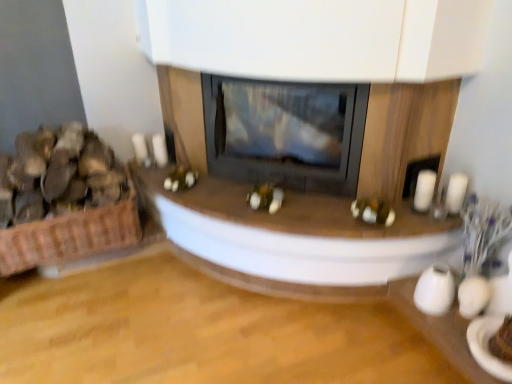
Question: Could you tell me if white glossy candle at right, which ranks as the 1th candle in right-to-left order, is turned towards brown woven basket at left?

Choices:
 (A) no
 (B) yes

Answer: (A)

Question: Is white glossy candle at right, placed as the second candle when sorted from left to right, completely or partially outside of brown woven basket at left?

Choices:
 (A) no
 (B) yes

Answer: (B)

Question: From a real-world perspective, is white glossy candle at right, which ranks as the 1th candle in right-to-left order, on brown woven basket at left?

Choices:
 (A) no
 (B) yes

Answer: (A)

Question: Would you consider white glossy candle at right, which ranks as the 1th candle in right-to-left order, to be distant from brown woven basket at left?

Choices:
 (A) yes
 (B) no

Answer: (A)

Question: From the image's perspective, does white glossy candle at right, placed as the second candle when sorted from left to right, appear higher than brown woven basket at left?

Choices:
 (A) yes
 (B) no

Answer: (B)

Question: Looking at the image, does brown woven basket at left seem bigger or smaller compared to black glass wood burning stove at center?

Choices:
 (A) small
 (B) big

Answer: (A)

Question: In terms of width, does brown woven basket at left look wider or thinner when compared to black glass wood burning stove at center?

Choices:
 (A) thin
 (B) wide

Answer: (B)

Question: From their relative heights in the image, would you say brown woven basket at left is taller or shorter than black glass wood burning stove at center?

Choices:
 (A) tall
 (B) short

Answer: (B)

Question: In the image, is brown woven basket at left positioned in front of or behind black glass wood burning stove at center?

Choices:
 (A) front
 (B) behind

Answer: (A)

Question: In terms of height, does brown woven basket at left look taller or shorter compared to woven brown basket at left?

Choices:
 (A) short
 (B) tall

Answer: (B)

Question: From the image's perspective, is brown woven basket at left positioned above or below woven brown basket at left?

Choices:
 (A) below
 (B) above

Answer: (B)

Question: Is point (82, 147) positioned closer to the camera than point (57, 248)?

Choices:
 (A) farther
 (B) closer

Answer: (B)

Question: From a real-world perspective, is brown woven basket at left above or below woven brown basket at left?

Choices:
 (A) above
 (B) below

Answer: (A)

Question: Considering their positions, is woven brown basket at left located in front of or behind white matte candle at right, the first candle from the left?

Choices:
 (A) behind
 (B) front

Answer: (A)

Question: Is woven brown basket at left bigger or smaller than white matte candle at right, the first candle from the left?

Choices:
 (A) small
 (B) big

Answer: (B)